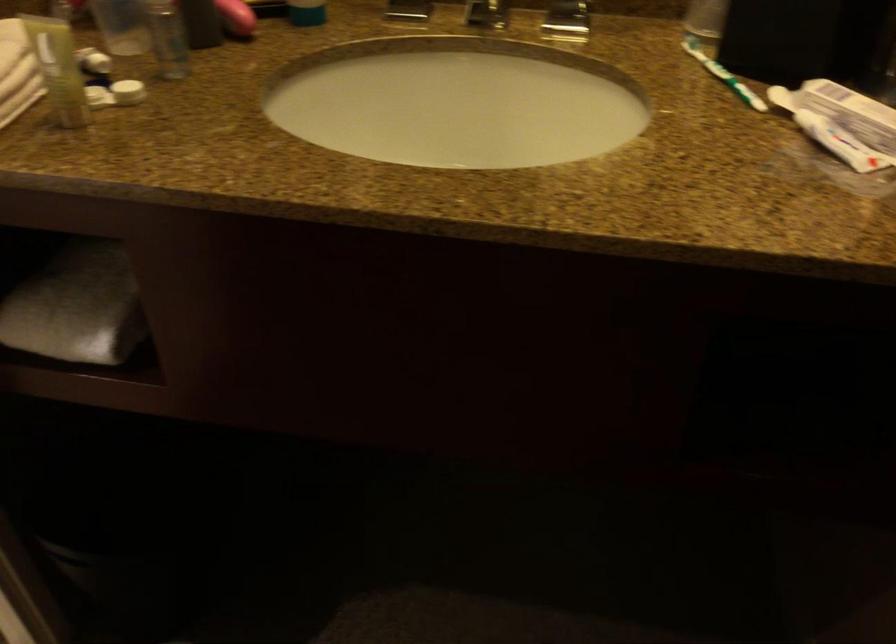
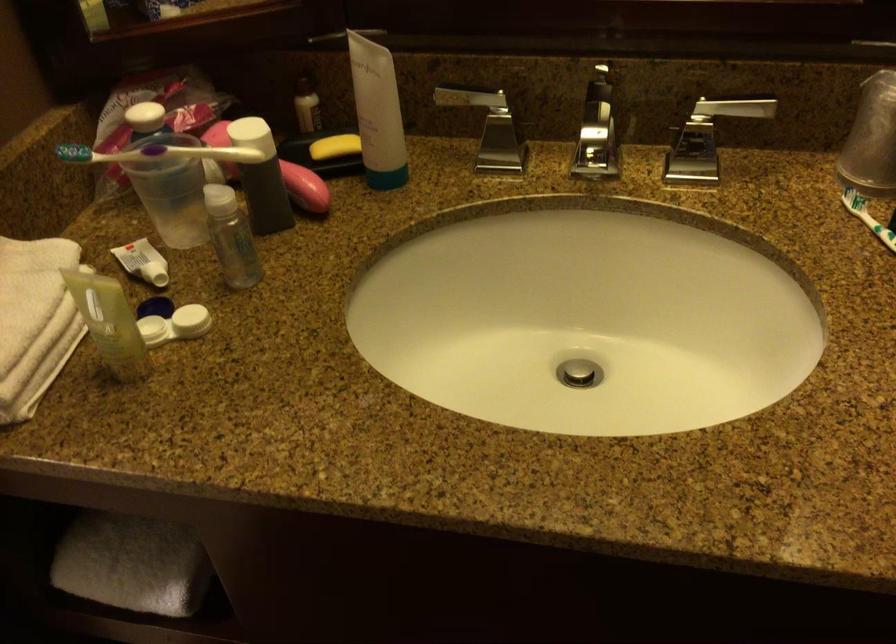
Question: The camera is either moving clockwise (left) or counter-clockwise (right) around the object. The first image is from the beginning of the video and the second image is from the end. Is the camera moving left or right when shooting the video?

Choices:
 (A) Left
 (B) Right

Answer: (B)